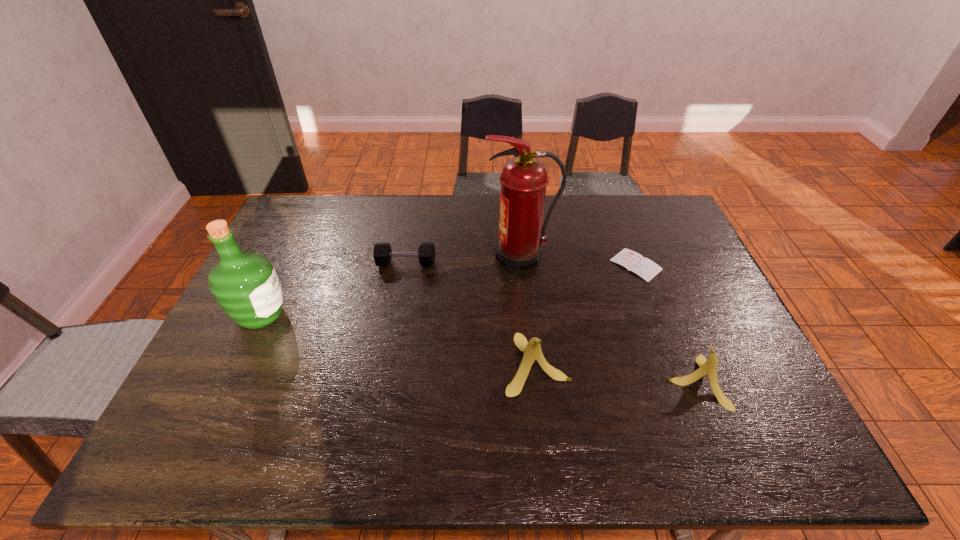
This screenshot has height=540, width=960. I want to click on the taller banana, so click(x=532, y=350).

Locate an element on the screen. the left banana is located at coordinates (532, 350).

Where is `the right banana`? The image size is (960, 540). the right banana is located at coordinates (708, 367).

At what (x,y) coordinates should I click in order to perform the action: click on the third shortest object. Please return your answer as a coordinate pair (x, y). This screenshot has height=540, width=960. Looking at the image, I should click on (708, 367).

This screenshot has height=540, width=960. I want to click on the tallest object, so click(x=523, y=179).

At what (x,y) coordinates should I click in order to perform the action: click on diary. Please return your answer as a coordinate pair (x, y). This screenshot has height=540, width=960. Looking at the image, I should click on (632, 261).

Where is `the second shortest object`? This screenshot has width=960, height=540. the second shortest object is located at coordinates (382, 254).

The image size is (960, 540). I want to click on the fifth object from right to left, so click(382, 254).

Where is `liquor`? This screenshot has width=960, height=540. liquor is located at coordinates (245, 284).

In order to click on the leftmost object in this screenshot , I will do (x=245, y=284).